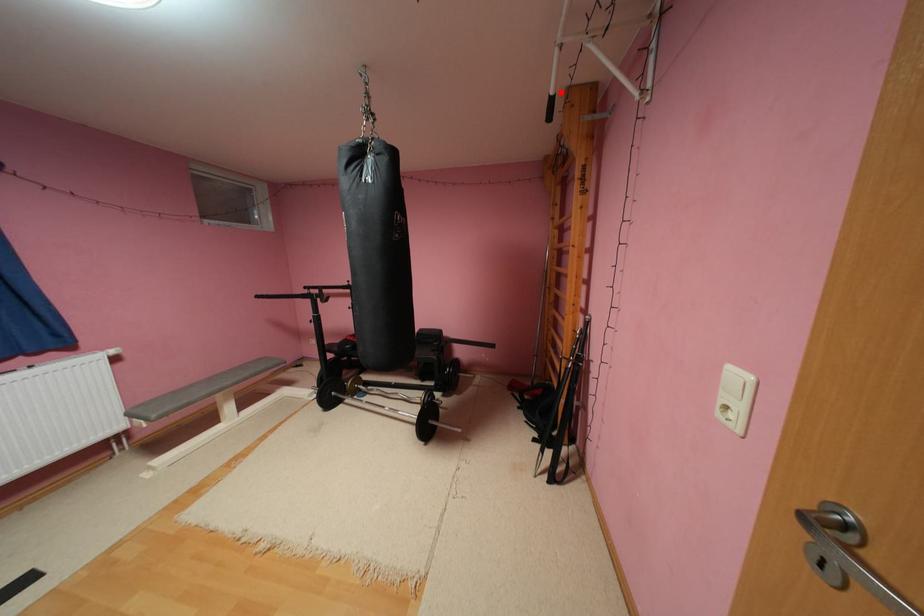
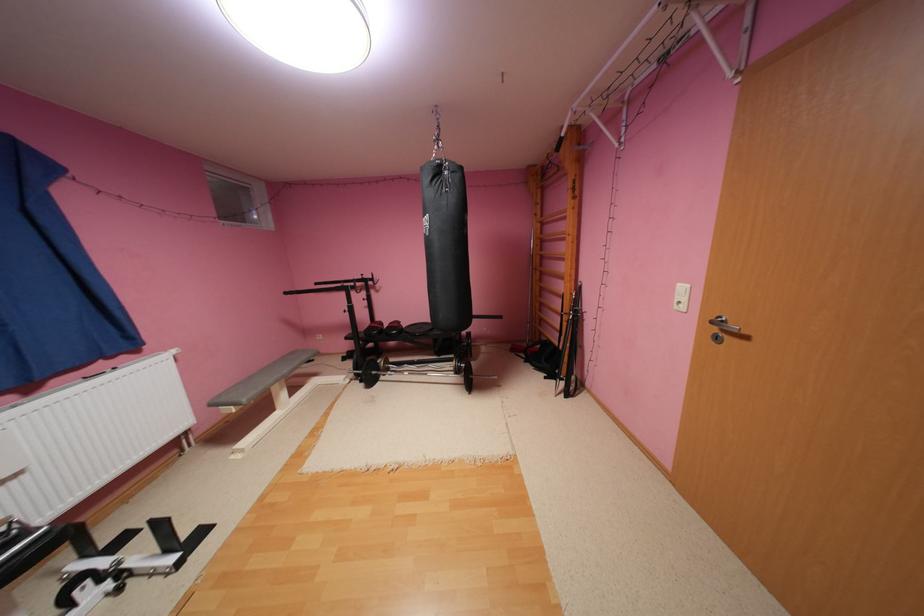
The point at the highlighted location is marked in the first image. Where is the corresponding point in the second image?

(572, 135)